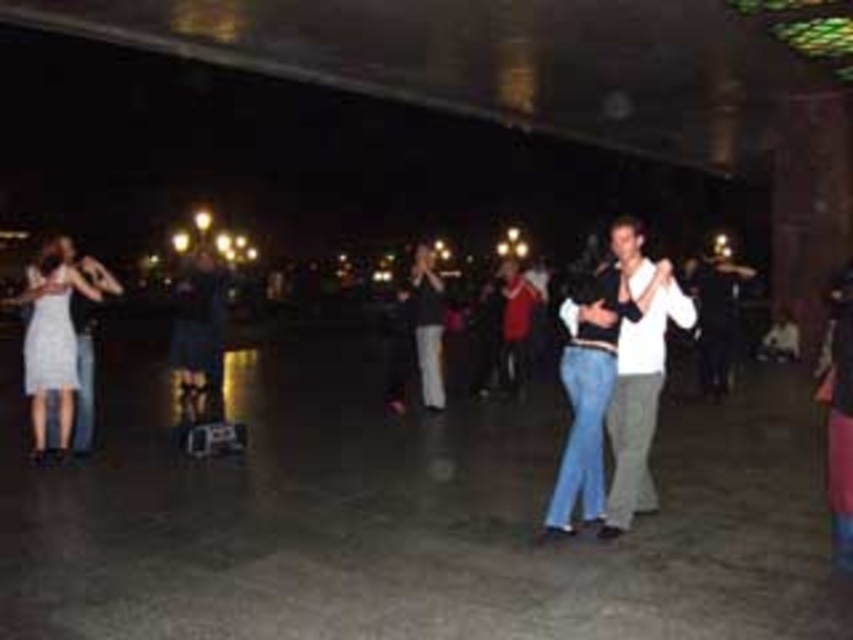
Question: Is white matte shirt at center wider than matte black dress at center?

Choices:
 (A) no
 (B) yes

Answer: (A)

Question: From the image, what is the correct spatial relationship of white matte shirt at center in relation to matte white dress at left?

Choices:
 (A) right
 (B) left

Answer: (A)

Question: Estimate the real-world distances between objects in this image. Which object is farther from the white matte shirt at center?

Choices:
 (A) matte black dress at center
 (B) matte white dress at left

Answer: (A)

Question: Which of the following is the closest to the observer?

Choices:
 (A) matte black dress at center
 (B) matte white dress at left
 (C) white matte shirt at center

Answer: (C)

Question: Among these objects, which one is nearest to the camera?

Choices:
 (A) matte black dress at center
 (B) matte white dress at left

Answer: (B)

Question: Is matte white dress at left bigger than matte black dress at center?

Choices:
 (A) yes
 (B) no

Answer: (A)